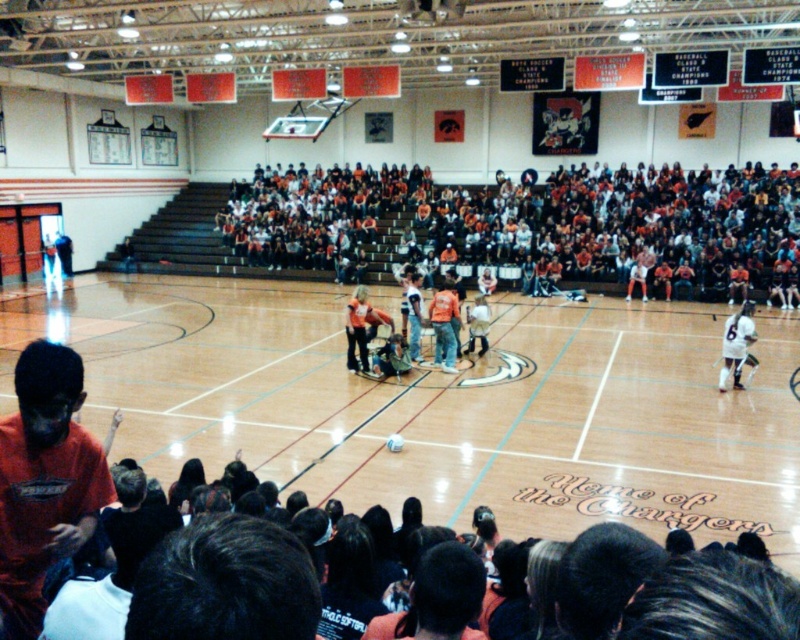
Question: Observing the image, what is the correct spatial positioning of wooden floor at center in reference to orange fabric seats at upper center?

Choices:
 (A) below
 (B) above

Answer: (A)

Question: Which point appears closest to the camera in this image?

Choices:
 (A) (306, 182)
 (B) (72, 541)

Answer: (B)

Question: Among these points, which one is farthest from the camera?

Choices:
 (A) (629, 273)
 (B) (548, 486)
 (C) (32, 448)
 (D) (744, 362)

Answer: (A)

Question: Which point is farther to the camera?

Choices:
 (A) (30, 419)
 (B) (476, 483)
 (C) (724, 348)

Answer: (C)

Question: Can you confirm if orange cotton shirt at lower left is positioned above white jersey at right?

Choices:
 (A) yes
 (B) no

Answer: (B)

Question: Is orange cotton shirt at lower left to the right of white jersey at right from the viewer's perspective?

Choices:
 (A) no
 (B) yes

Answer: (A)